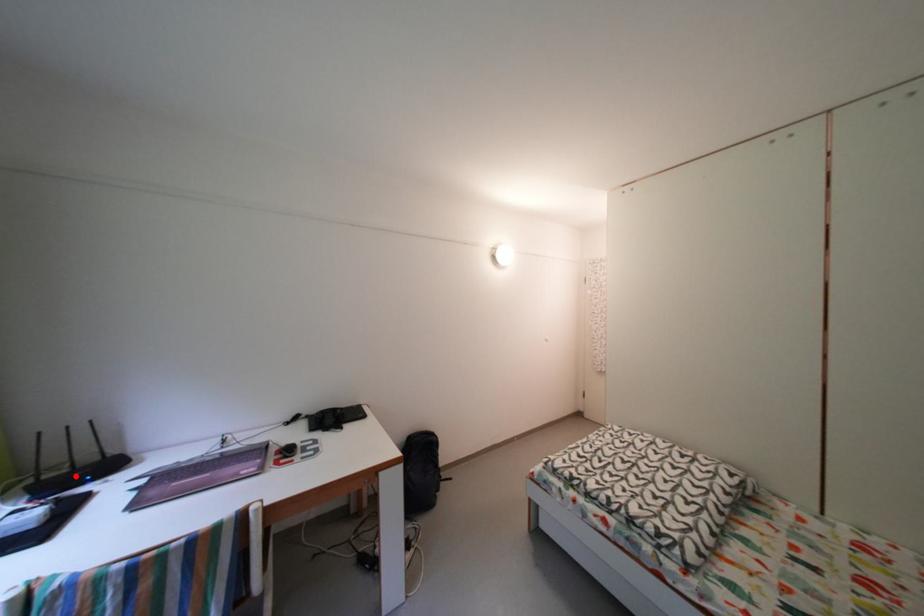
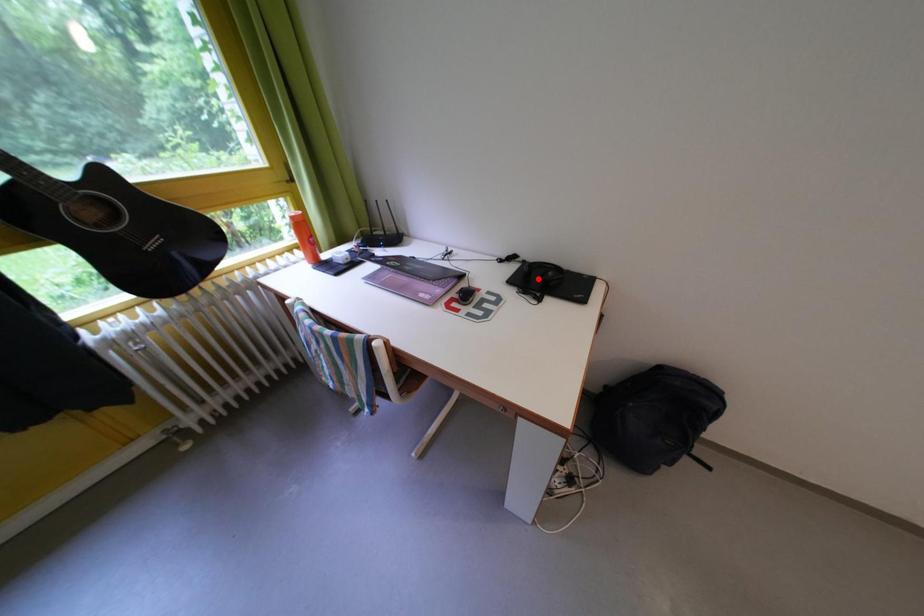
I am providing you with two images of the same scene from different viewpoints. A red point is marked on the first image and another point is marked on the second image. Does the point marked in image1 correspond to the same location as the one in image2?

No